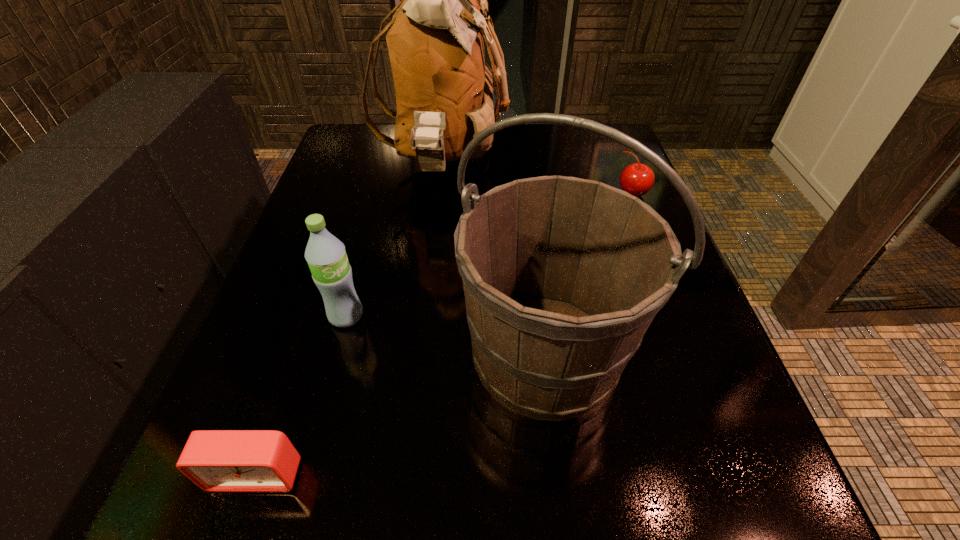
The width and height of the screenshot is (960, 540). Identify the location of backpack. (444, 88).

This screenshot has height=540, width=960. I want to click on bucket, so click(562, 276).

This screenshot has height=540, width=960. I want to click on water bottle, so click(326, 256).

Locate an element on the screen. This screenshot has height=540, width=960. the rightmost object is located at coordinates (637, 179).

The width and height of the screenshot is (960, 540). I want to click on alarm clock, so click(x=215, y=460).

I want to click on vacant space situated on the front-facing side of the backpack, so click(x=527, y=165).

Where is `vacant area located on the back of the bucket`? The width and height of the screenshot is (960, 540). vacant area located on the back of the bucket is located at coordinates (532, 241).

Find the location of a particular element. The width and height of the screenshot is (960, 540). vacant space situated 0.280m on the right of the water bottle is located at coordinates (529, 316).

The image size is (960, 540). What are the coordinates of `vacant space located 0.150m on the left of the cherry` in the screenshot? It's located at (550, 193).

Find the location of a particular element. free location located on the front-facing side of the nearest object is located at coordinates (234, 539).